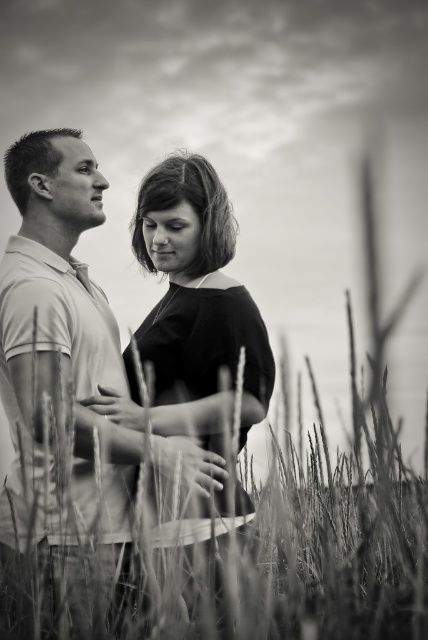
Question: Can you confirm if smooth black dress at center is positioned to the left of fuzzy grass at center?

Choices:
 (A) yes
 (B) no

Answer: (A)

Question: Considering the relative positions of smooth black dress at center and fuzzy grass at center in the image provided, where is smooth black dress at center located with respect to fuzzy grass at center?

Choices:
 (A) above
 (B) below

Answer: (A)

Question: In this image, where is smooth black dress at center located relative to fuzzy grass at center?

Choices:
 (A) left
 (B) right

Answer: (A)

Question: Which point is closer to the camera?

Choices:
 (A) fuzzy grass at center
 (B) smooth black dress at center

Answer: (A)